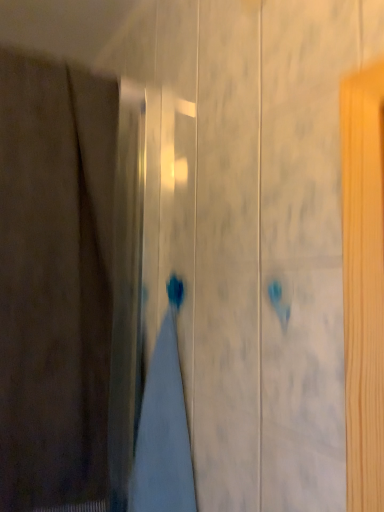
You are a GUI agent. You are given a task and a screenshot of the screen. Output one action in this format:
    pyautogui.click(x=<x>, y=<y>)
    Task: Click on the gray cotton bath towel at center
    Image resolution: width=384 pixels, height=512 pixels.
    Given the screenshot: What is the action you would take?
    pyautogui.click(x=164, y=426)

Describe the element at coordinates (164, 426) in the screenshot. This screenshot has width=384, height=512. I see `gray cotton bath towel at center` at that location.

The image size is (384, 512). Find the location of `brown fabric curtain at left`. brown fabric curtain at left is located at coordinates (54, 281).

The width and height of the screenshot is (384, 512). What do you see at coordinates (54, 281) in the screenshot? I see `brown fabric curtain at left` at bounding box center [54, 281].

Image resolution: width=384 pixels, height=512 pixels. What are the coordinates of `gray cotton bath towel at center` in the screenshot? It's located at (164, 426).

Which object is positioned more to the right, brown fabric curtain at left or gray cotton bath towel at center?

From the viewer's perspective, gray cotton bath towel at center appears more on the right side.

Is brown fabric curtain at left in front of or behind gray cotton bath towel at center in the image?

brown fabric curtain at left is positioned closer to the viewer than gray cotton bath towel at center.

Which point is more forward, (56,82) or (169,397)?

The point (169,397) is closer.

From the image's perspective, is brown fabric curtain at left positioned above or below gray cotton bath towel at center?

brown fabric curtain at left is above gray cotton bath towel at center.

From a real-world perspective, is brown fabric curtain at left positioned under gray cotton bath towel at center based on gravity?

No.

Considering the sizes of brown fabric curtain at left and gray cotton bath towel at center in the image, is brown fabric curtain at left wider or thinner than gray cotton bath towel at center?

brown fabric curtain at left is wider than gray cotton bath towel at center.

Is brown fabric curtain at left taller than gray cotton bath towel at center?

Yes.

Considering the relative sizes of brown fabric curtain at left and gray cotton bath towel at center in the image provided, is brown fabric curtain at left smaller than gray cotton bath towel at center?

No.

Is gray cotton bath towel at center completely or partially inside brown fabric curtain at left?

No, gray cotton bath towel at center is located outside of brown fabric curtain at left.

Is brown fabric curtain at left not near gray cotton bath towel at center?

No.

Could you tell me if brown fabric curtain at left is turned towards gray cotton bath towel at center?

No.

How different are the orientations of brown fabric curtain at left and gray cotton bath towel at center in degrees?

The angular difference between brown fabric curtain at left and gray cotton bath towel at center is 89.2 degrees.

Image resolution: width=384 pixels, height=512 pixels. Find the location of `curtain that appears above the gray cotton bath towel at center (from the image's perspective)`. curtain that appears above the gray cotton bath towel at center (from the image's perspective) is located at coordinates (54, 281).

Can you confirm if gray cotton bath towel at center is positioned to the right of brown fabric curtain at left?

Indeed, gray cotton bath towel at center is positioned on the right side of brown fabric curtain at left.

Is gray cotton bath towel at center in front of or behind brown fabric curtain at left in the image?

gray cotton bath towel at center is behind brown fabric curtain at left.

Is point (154, 381) closer to camera compared to point (105, 357)?

Yes, point (154, 381) is in front of point (105, 357).

From the image's perspective, is gray cotton bath towel at center above or below brown fabric curtain at left?

From the image's perspective, gray cotton bath towel at center appears below brown fabric curtain at left.

From a real-world perspective, which object rests below the other?

gray cotton bath towel at center, from a real-world perspective.

Consider the image. Looking at their sizes, would you say gray cotton bath towel at center is wider or thinner than brown fabric curtain at left?

gray cotton bath towel at center is thinner than brown fabric curtain at left.

From their relative heights in the image, would you say gray cotton bath towel at center is taller or shorter than brown fabric curtain at left?

Clearly, gray cotton bath towel at center is shorter compared to brown fabric curtain at left.

Looking at this image, looking at the image, does gray cotton bath towel at center seem bigger or smaller compared to brown fabric curtain at left?

In the image, gray cotton bath towel at center appears to be smaller than brown fabric curtain at left.

Is gray cotton bath towel at center situated inside brown fabric curtain at left or outside?

gray cotton bath towel at center cannot be found inside brown fabric curtain at left.

Is there a large distance between gray cotton bath towel at center and brown fabric curtain at left?

gray cotton bath towel at center is near brown fabric curtain at left, not far away.

Is gray cotton bath towel at center aimed at brown fabric curtain at left?

No, gray cotton bath towel at center is not turned towards brown fabric curtain at left.

How far apart are gray cotton bath towel at center and brown fabric curtain at left?

gray cotton bath towel at center and brown fabric curtain at left are 9.29 inches apart.

Find the location of a particular element. bath towel lying on the right of brown fabric curtain at left is located at coordinates click(x=164, y=426).

Locate an element on the screen. The width and height of the screenshot is (384, 512). curtain above the gray cotton bath towel at center (from the image's perspective) is located at coordinates (54, 281).

This screenshot has width=384, height=512. I want to click on bath towel located below the brown fabric curtain at left (from the image's perspective), so click(164, 426).